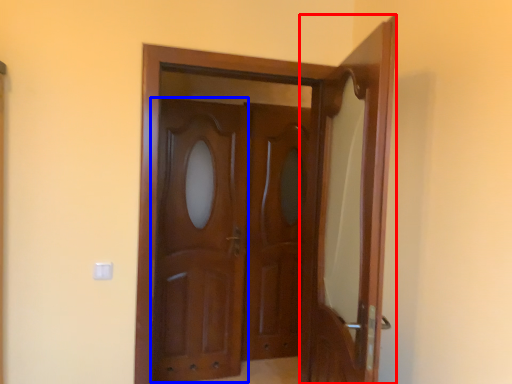
Question: Which point is closer to the camera, door (highlighted by a red box) or barn door (highlighted by a blue box)?

Choices:
 (A) door
 (B) barn door

Answer: (A)